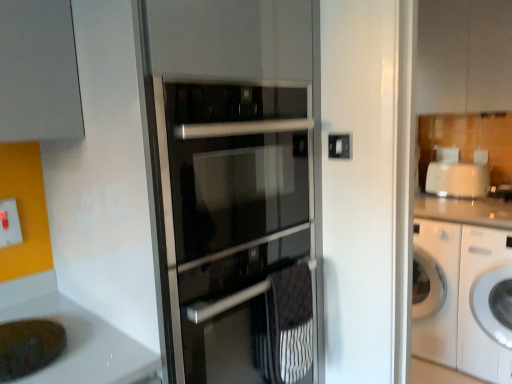
Question: Does white glossy cabinet at upper center lie behind white glossy washing machine at right?

Choices:
 (A) yes
 (B) no

Answer: (A)

Question: Is white glossy cabinet at upper center closer to the viewer compared to white glossy washing machine at right?

Choices:
 (A) yes
 (B) no

Answer: (B)

Question: Is white glossy cabinet at upper center looking in the opposite direction of white glossy washing machine at right?

Choices:
 (A) no
 (B) yes

Answer: (A)

Question: From a real-world perspective, does white glossy cabinet at upper center stand above white glossy washing machine at right?

Choices:
 (A) no
 (B) yes

Answer: (B)

Question: Is white glossy cabinet at upper center positioned far away from white glossy washing machine at right?

Choices:
 (A) yes
 (B) no

Answer: (A)

Question: Considering the relative positions of white glossy washing machine at right and white glossy cabinet at upper center in the image provided, is white glossy washing machine at right to the left or to the right of white glossy cabinet at upper center?

Choices:
 (A) right
 (B) left

Answer: (A)

Question: From the image's perspective, is white glossy washing machine at right positioned above or below white glossy cabinet at upper center?

Choices:
 (A) below
 (B) above

Answer: (A)

Question: Is white glossy washing machine at right wider or thinner than white glossy cabinet at upper center?

Choices:
 (A) wide
 (B) thin

Answer: (A)

Question: Do you think white glossy washing machine at right is within white glossy cabinet at upper center, or outside of it?

Choices:
 (A) outside
 (B) inside

Answer: (A)

Question: Is point (266, 302) closer or farther from the camera than point (430, 29)?

Choices:
 (A) closer
 (B) farther

Answer: (A)

Question: Considering the positions of black textured towel at center and white glossy cabinet at upper center in the image, is black textured towel at center bigger or smaller than white glossy cabinet at upper center?

Choices:
 (A) small
 (B) big

Answer: (A)

Question: From a real-world perspective, is black textured towel at center above or below white glossy cabinet at upper center?

Choices:
 (A) above
 (B) below

Answer: (B)

Question: Based on their positions, is black textured towel at center located to the left or right of white glossy cabinet at upper center?

Choices:
 (A) right
 (B) left

Answer: (B)

Question: Is black textured towel at center wider or thinner than white glossy washing machine at right?

Choices:
 (A) wide
 (B) thin

Answer: (B)

Question: Considering the positions of point (306, 311) and point (498, 367), is point (306, 311) closer or farther from the camera than point (498, 367)?

Choices:
 (A) closer
 (B) farther

Answer: (A)